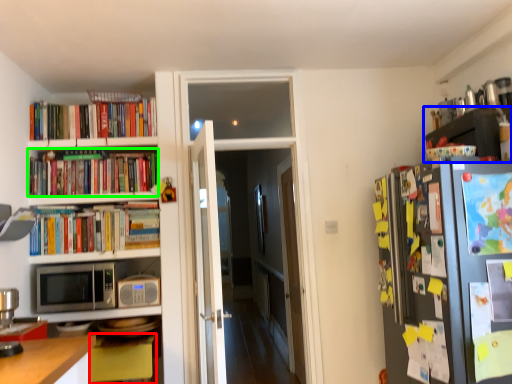
Question: Which is nearer to the table (highlighted by a red box)? shelf (highlighted by a blue box) or book (highlighted by a green box).

Choices:
 (A) shelf
 (B) book

Answer: (B)